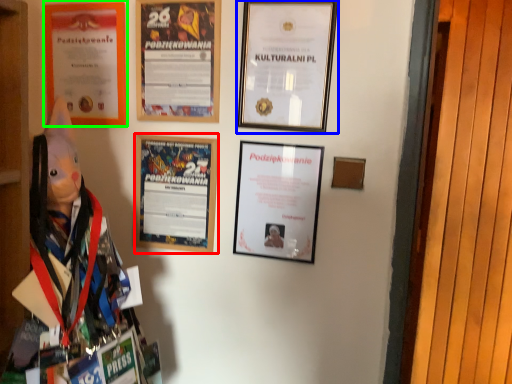
Question: Based on their relative distances, which object is farther from picture frame (highlighted by a red box)? Choose from picture frame (highlighted by a blue box) and picture frame (highlighted by a green box).

Choices:
 (A) picture frame
 (B) picture frame

Answer: (A)